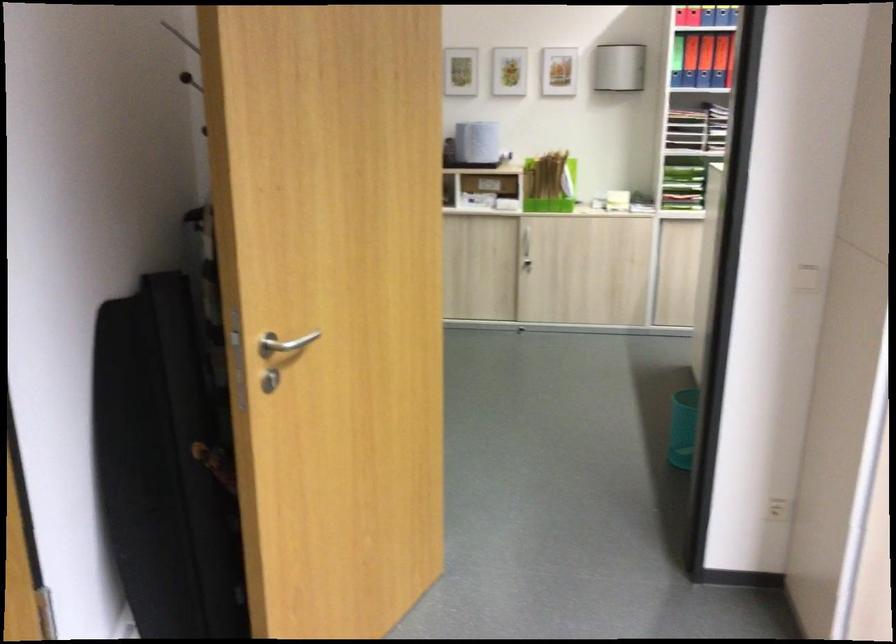
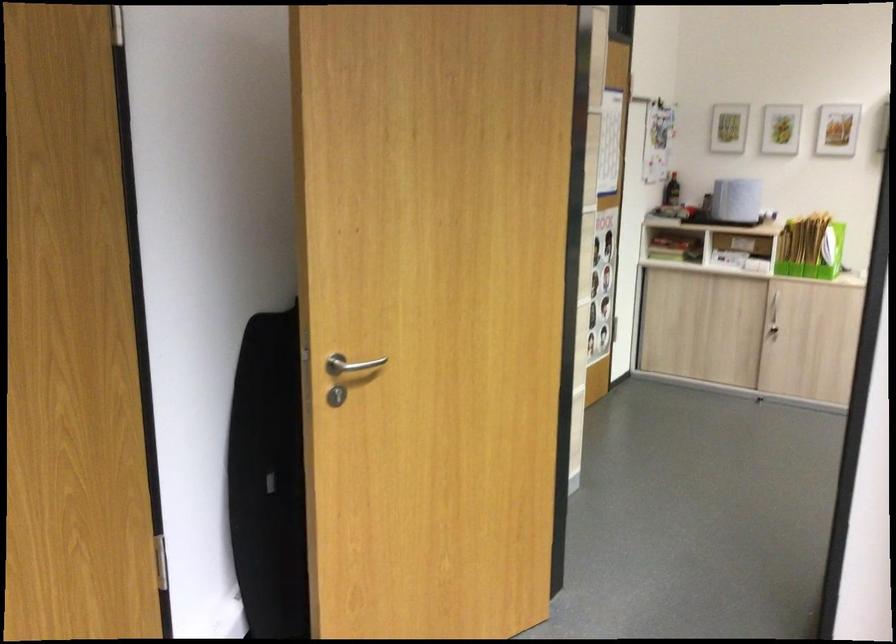
The point at (x=528, y=251) is marked in the first image. Where is the corresponding point in the second image?

(771, 317)